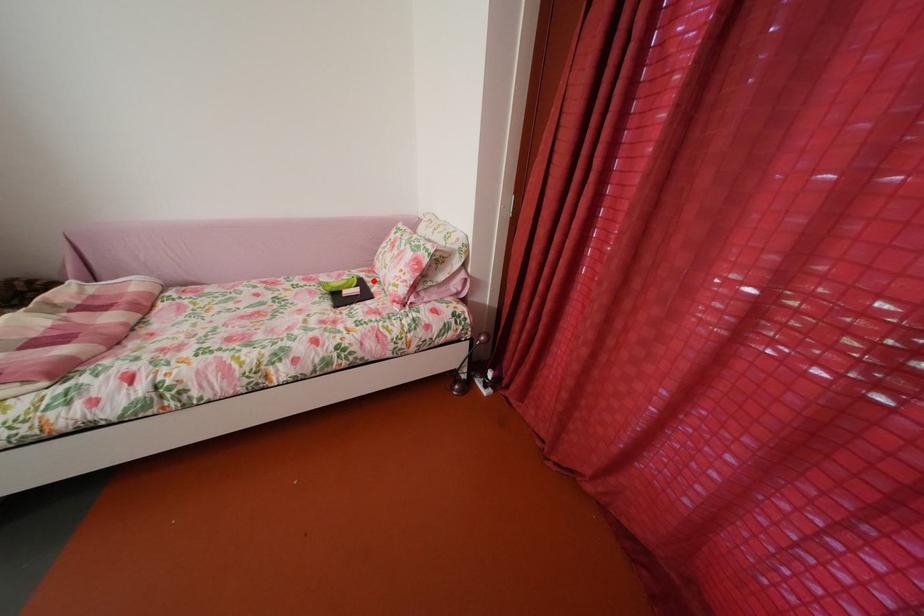
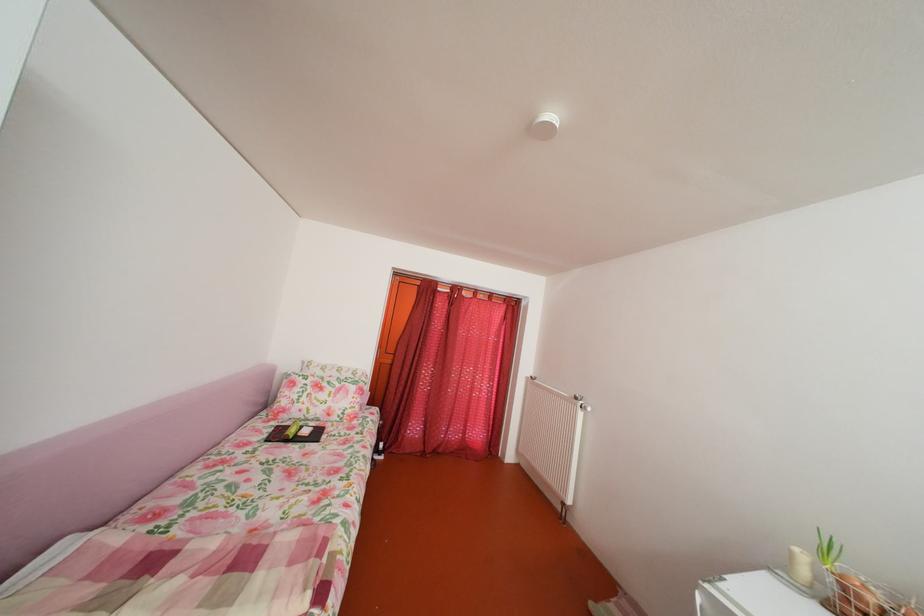
Locate, in the second image, the point that corresponds to the highlighted location in the first image.

(286, 430)